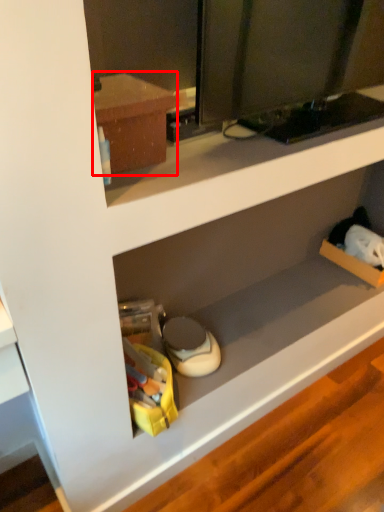
Question: Considering the relative positions of cabinetry (annotated by the red box) and shelf in the image provided, where is cabinetry (annotated by the red box) located with respect to the staircase?

Choices:
 (A) right
 (B) left

Answer: (B)